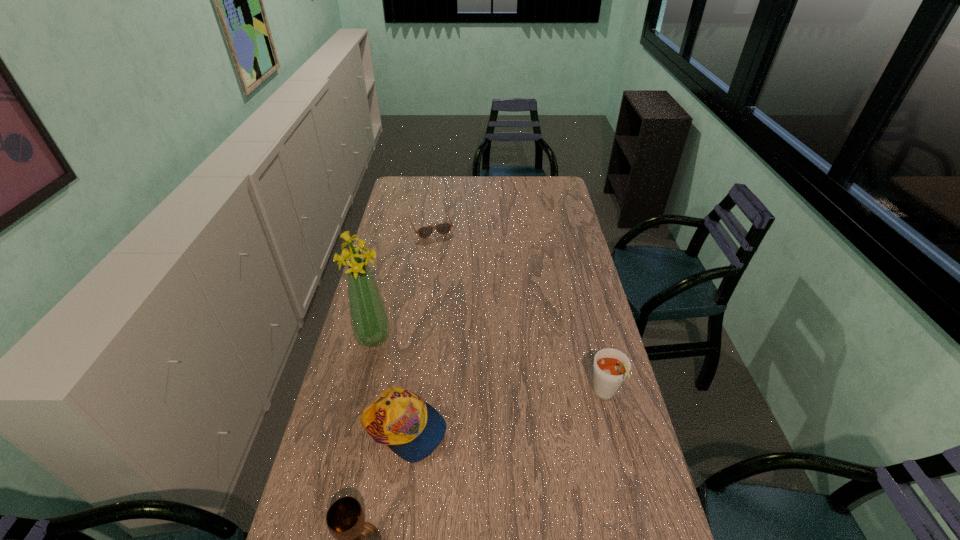
Where is `blank space at the far edge of the desktop`? The image size is (960, 540). blank space at the far edge of the desktop is located at coordinates (492, 184).

I want to click on vacant space at the near edge of the desktop, so click(x=589, y=534).

In the image, there is a desktop. Where is `free space at the left edge`? This screenshot has width=960, height=540. free space at the left edge is located at coordinates (340, 414).

The image size is (960, 540). In the image, there is a desktop. Find the location of `vacant space at the right edge`. vacant space at the right edge is located at coordinates (579, 332).

In the image, there is a desktop. Identify the location of free space at the near left corner. (310, 534).

At what (x,y) coordinates should I click in order to perform the action: click on vacant space at the far right corner of the desktop. Please return your answer as a coordinate pair (x, y). The image size is (960, 540). Looking at the image, I should click on (548, 190).

You are a GUI agent. You are given a task and a screenshot of the screen. Output one action in this format:
    pyautogui.click(x=<x>, y=<y>)
    Task: Click on the empty space between the second shortest object and the rightmost object
    
    Given the screenshot: What is the action you would take?
    pyautogui.click(x=504, y=413)

Identify the location of free space that is in between the shortest object and the second farthest object. The height and width of the screenshot is (540, 960). (402, 282).

Identify the location of vacant area between the rightmost object and the shortest object. The height and width of the screenshot is (540, 960). (517, 311).

Where is `blank region between the cap and the fourth nearest object`? The height and width of the screenshot is (540, 960). blank region between the cap and the fourth nearest object is located at coordinates (389, 383).